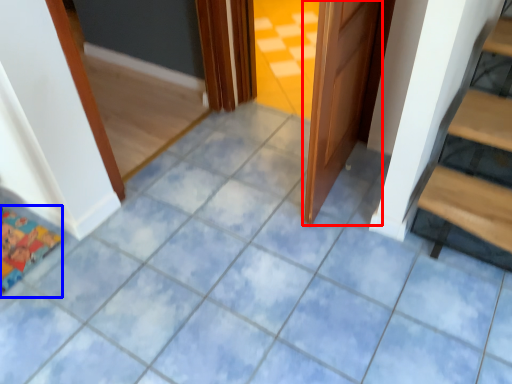
Question: Which object appears closest to the camera in this image, door (highlighted by a red box) or doormat (highlighted by a blue box)?

Choices:
 (A) door
 (B) doormat

Answer: (A)